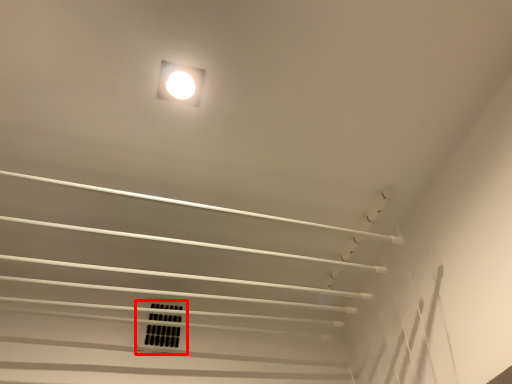
Question: Observing the image, what is the correct spatial positioning of window (annotated by the red box) in reference to lamp?

Choices:
 (A) left
 (B) right

Answer: (A)